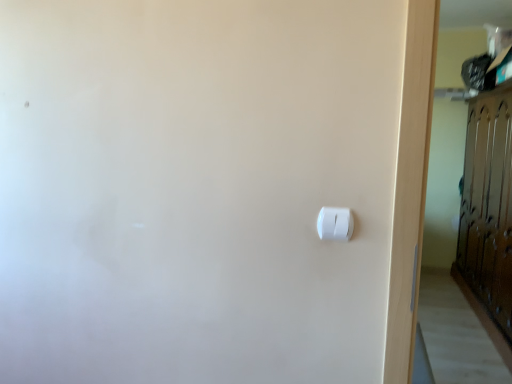
The width and height of the screenshot is (512, 384). Describe the element at coordinates (488, 205) in the screenshot. I see `brown metallic dresser at right` at that location.

Where is `brown metallic dresser at right`? Image resolution: width=512 pixels, height=384 pixels. brown metallic dresser at right is located at coordinates pos(488,205).

The height and width of the screenshot is (384, 512). Find the location of `brown metallic dresser at right`. brown metallic dresser at right is located at coordinates (488, 205).